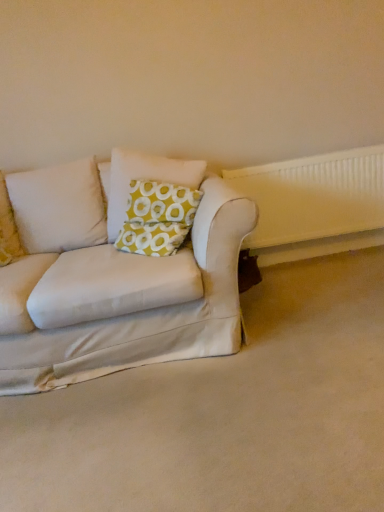
The image size is (384, 512). What do you see at coordinates (144, 179) in the screenshot? I see `yellow-green fabric pillow at center` at bounding box center [144, 179].

The height and width of the screenshot is (512, 384). What do you see at coordinates (314, 196) in the screenshot?
I see `white plastic radiator at right` at bounding box center [314, 196].

Find the location of a particular element. white fabric couch at lower left is located at coordinates (225, 412).

Can you see yellow-green fabric pillow at center touching white fabric couch at lower left?

yellow-green fabric pillow at center is not next to white fabric couch at lower left, and they're not touching.

How many degrees apart are the facing directions of yellow-green fabric pillow at center and white fabric couch at lower left?

yellow-green fabric pillow at center and white fabric couch at lower left are facing 98.7 degrees away from each other.

Which object is wider, yellow-green fabric pillow at center or white fabric couch at lower left?

Wider between the two is white fabric couch at lower left.

In the scene shown: From the image's perspective, is yellow-green fabric pillow at center positioned above or below white fabric couch at lower left?

From the image's perspective, yellow-green fabric pillow at center appears above white fabric couch at lower left.

From a real-world perspective, is yellow-green fabric pillow at center above or below white plastic radiator at right?

From a real-world perspective, yellow-green fabric pillow at center is physically above white plastic radiator at right.

Is yellow-green fabric pillow at center shorter than white plastic radiator at right?

Correct, yellow-green fabric pillow at center is not as tall as white plastic radiator at right.

Considering the sizes of objects yellow-green fabric pillow at center and white plastic radiator at right in the image provided, who is wider, yellow-green fabric pillow at center or white plastic radiator at right?

yellow-green fabric pillow at center is wider.

Could you tell me if white fabric couch at lower left is facing yellow-green fabric pillow at center?

No.

Is point (221, 388) positioned behind point (121, 176)?

No, (221, 388) is in front of (121, 176).

From a real-world perspective, is white fabric couch at lower left above or below yellow-green fabric pillow at center?

white fabric couch at lower left is situated lower than yellow-green fabric pillow at center in the real world.

Between white fabric couch at lower left and yellow-green fabric pillow at center, which one has larger size?

white fabric couch at lower left is bigger.

Can you confirm if white fabric couch at lower left is positioned to the left of white plastic radiator at right?

Indeed, white fabric couch at lower left is positioned on the left side of white plastic radiator at right.

In terms of width, does white fabric couch at lower left look wider or thinner when compared to white plastic radiator at right?

Considering their sizes, white fabric couch at lower left looks broader than white plastic radiator at right.

From a real-world perspective, is white fabric couch at lower left positioned over white plastic radiator at right based on gravity?

No, from a real-world perspective, white fabric couch at lower left is not on top of white plastic radiator at right.

Is point (263, 464) farther from camera compared to point (275, 211)?

That is False.

Which is in front, point (273, 202) or point (145, 161)?

The point (145, 161) is closer.

Would you say white plastic radiator at right contains yellow-green fabric pillow at center?

That's incorrect, yellow-green fabric pillow at center is not inside white plastic radiator at right.

From the picture: How many degrees apart are the facing directions of white plastic radiator at right and yellow-green fabric pillow at center?

The angular difference between white plastic radiator at right and yellow-green fabric pillow at center is 8.82 degrees.

From the image's perspective, would you say white plastic radiator at right is shown under yellow-green fabric pillow at center?

Yes.

Is white plastic radiator at right further to camera compared to white fabric couch at lower left?

Yes, the depth of white plastic radiator at right is greater than that of white fabric couch at lower left.

Is white plastic radiator at right spatially inside white fabric couch at lower left, or outside of it?

white plastic radiator at right is spatially situated outside white fabric couch at lower left.

Can you confirm if white plastic radiator at right is shorter than white fabric couch at lower left?

Incorrect, the height of white plastic radiator at right does not fall short of that of white fabric couch at lower left.

At what (x,y) coordinates should I click in order to perform the action: click on pillow located above the white fabric couch at lower left (from the image's perspective). Please return your answer as a coordinate pair (x, y). Looking at the image, I should click on (144, 179).

In order to click on radiator that appears behind the yellow-green fabric pillow at center in this screenshot , I will do point(314,196).

Based on their spatial positions, is yellow-green fabric pillow at center or white fabric couch at lower left closer to white plastic radiator at right?

Based on the image, yellow-green fabric pillow at center appears to be nearer to white plastic radiator at right.

Estimate the real-world distances between objects in this image. Which object is closer to white fabric couch at lower left, yellow-green fabric pillow at center or white plastic radiator at right?

Based on the image, yellow-green fabric pillow at center appears to be nearer to white fabric couch at lower left.

When comparing their distances from yellow-green fabric pillow at center, does white fabric couch at lower left or white plastic radiator at right seem further?

Based on the image, white fabric couch at lower left appears to be further to yellow-green fabric pillow at center.

Based on their spatial positions, is white plastic radiator at right or yellow-green fabric pillow at center further from white fabric couch at lower left?

Based on the image, white plastic radiator at right appears to be further to white fabric couch at lower left.

Which object lies further to the anchor point yellow-green fabric pillow at center, white plastic radiator at right or white fabric couch at lower left?

Based on the image, white fabric couch at lower left appears to be further to yellow-green fabric pillow at center.

Looking at the image, which one is located further to white plastic radiator at right, white fabric couch at lower left or yellow-green fabric pillow at center?

white fabric couch at lower left lies further to white plastic radiator at right than the other object.

At what (x,y) coordinates should I click in order to perform the action: click on pillow between white fabric couch at lower left and white plastic radiator at right along the z-axis. Please return your answer as a coordinate pair (x, y). This screenshot has width=384, height=512. Looking at the image, I should click on (144, 179).